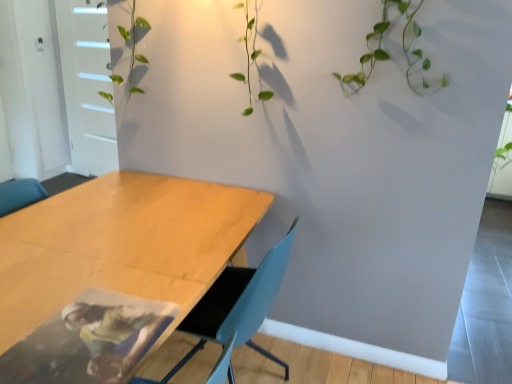
Question: Is white matte door at upper left shorter than wooden table at lower left?

Choices:
 (A) yes
 (B) no

Answer: (B)

Question: Is white matte door at upper left not close to wooden table at lower left?

Choices:
 (A) no
 (B) yes

Answer: (B)

Question: Can you confirm if white matte door at upper left is wider than wooden table at lower left?

Choices:
 (A) yes
 (B) no

Answer: (B)

Question: From the image's perspective, is white matte door at upper left beneath wooden table at lower left?

Choices:
 (A) yes
 (B) no

Answer: (B)

Question: From a real-world perspective, is white matte door at upper left on wooden table at lower left?

Choices:
 (A) yes
 (B) no

Answer: (A)

Question: Does point (278, 276) appear closer or farther from the camera than point (95, 94)?

Choices:
 (A) farther
 (B) closer

Answer: (B)

Question: From the image's perspective, is light blue plastic chair at center positioned above or below white matte door at upper left?

Choices:
 (A) below
 (B) above

Answer: (A)

Question: Considering the positions of light blue plastic chair at center and white matte door at upper left in the image, is light blue plastic chair at center wider or thinner than white matte door at upper left?

Choices:
 (A) thin
 (B) wide

Answer: (B)

Question: From a real-world perspective, relative to white matte door at upper left, is light blue plastic chair at center vertically above or below?

Choices:
 (A) below
 (B) above

Answer: (A)

Question: In the image, is wooden table at lower left on the left side or the right side of white matte door at upper left?

Choices:
 (A) left
 (B) right

Answer: (B)

Question: Is wooden table at lower left bigger or smaller than white matte door at upper left?

Choices:
 (A) small
 (B) big

Answer: (B)

Question: From a real-world perspective, is wooden table at lower left above or below white matte door at upper left?

Choices:
 (A) below
 (B) above

Answer: (A)

Question: Is wooden table at lower left taller or shorter than white matte door at upper left?

Choices:
 (A) short
 (B) tall

Answer: (A)

Question: From the image's perspective, is wooden table at lower left above or below light blue plastic chair at center?

Choices:
 (A) above
 (B) below

Answer: (B)

Question: Considering the positions of point (49, 251) and point (178, 326), is point (49, 251) closer or farther from the camera than point (178, 326)?

Choices:
 (A) farther
 (B) closer

Answer: (B)